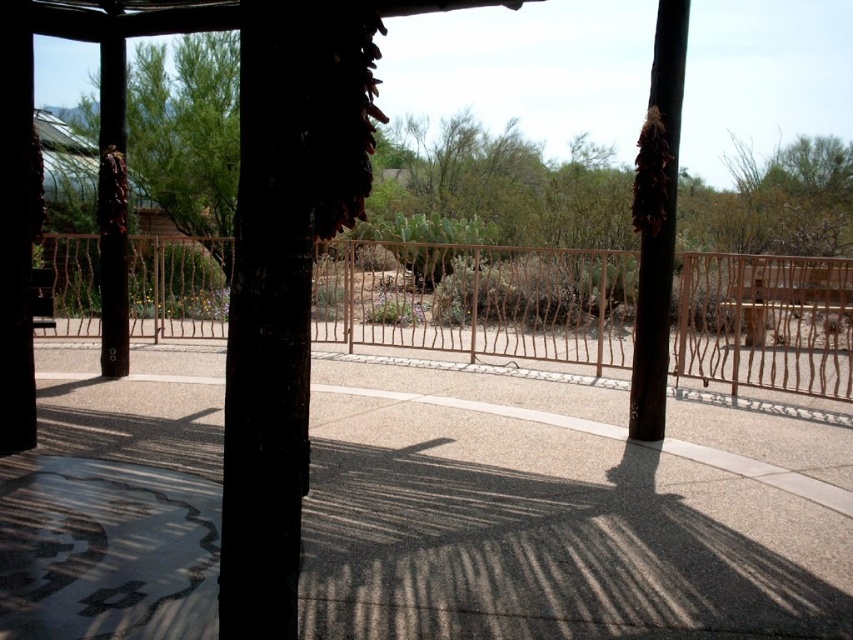
You are standing at the point marked by the coordinate point at (349, 244) and want to walk straight ahead. There is a wooden post on your left and another on your right. How far apart are the two wooden posts?

The two wooden posts are 9.24 meters apart.

In the scene shown: You are standing at the point marked as point (x=479, y=300) in the image. What object is located exactly at that point?

The rustic wood fence at center is located exactly at point (x=479, y=300).